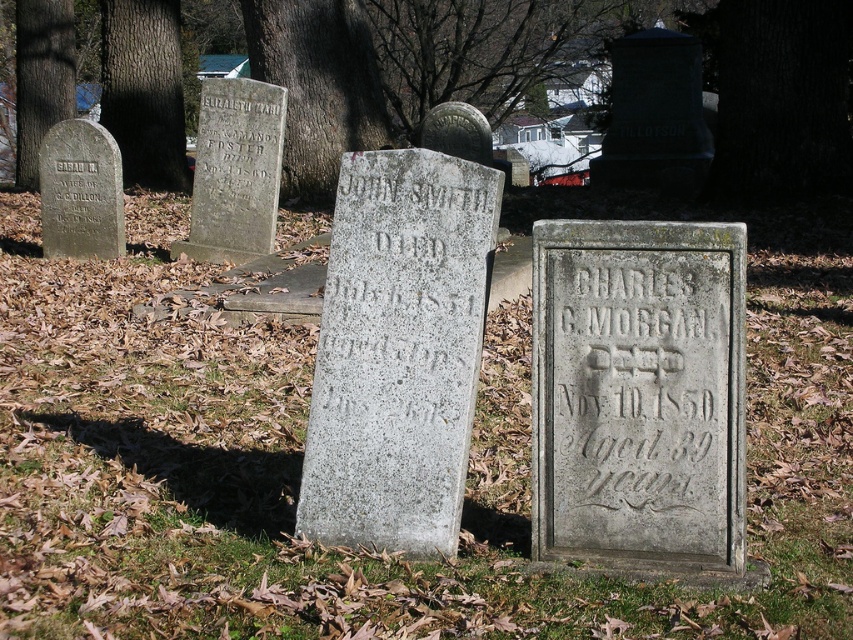
You are standing at the gray stone gravestone at center and want to walk to the dark brown bark at upper center. How many steps would you need to take if each step covers approximately 3 feet?

The gray stone gravestone at center is 33.33 feet away from the dark brown bark at upper center. Since each step covers 3 feet, you would need to take 11 steps to reach the dark brown bark at upper center.

You are standing in a cemetery and want to find the gray stone gravestone at upper left. You notice a smooth bark tree trunk at upper left. Which object is lower in position?

The gray stone gravestone at upper left is located below the smooth bark tree trunk at upper left, so the gravestone is lower.